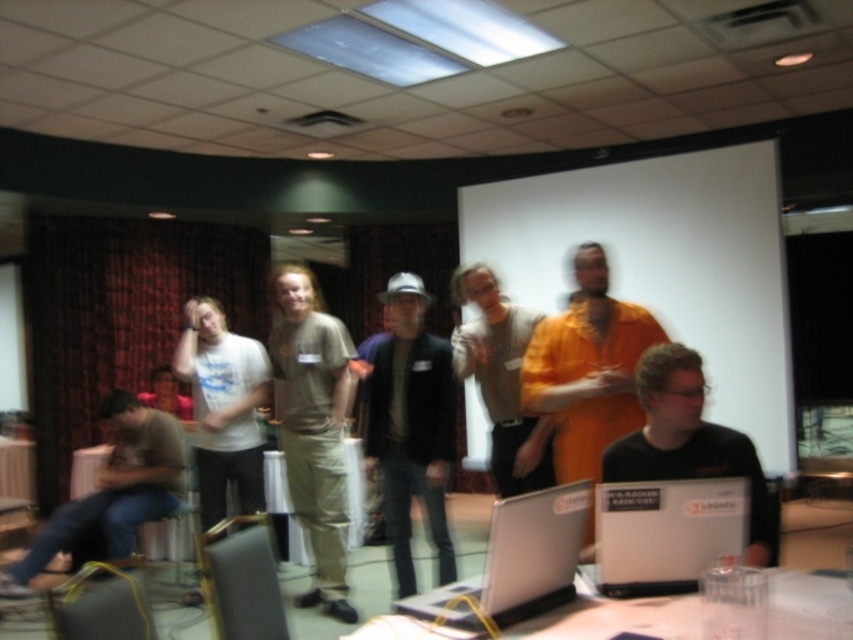
Can you confirm if metallic silver laptop at lower center is positioned above wooden table at lower left?

Yes.

Who is more forward, (x=264, y=611) or (x=71, y=468)?

Positioned in front is point (x=264, y=611).

Between point (242, 538) and point (283, 468), which one is positioned in front?

Point (242, 538)

Where is `metallic silver laptop at lower center`? This screenshot has width=853, height=640. metallic silver laptop at lower center is located at coordinates (241, 580).

Is point (279, 310) behind point (183, 412)?

No, it is not.

Is khaki cotton pants at center positioned in front of matte white shirt at center?

Yes, khaki cotton pants at center is in front of matte white shirt at center.

Which is behind, point (309, 472) or point (154, 406)?

The point (154, 406) is more distant.

Identify the location of khaki cotton pants at center. (312, 426).

Is black matte shirt at center taller than silver metallic laptop at center?

Yes, black matte shirt at center is taller than silver metallic laptop at center.

Does point (648, 412) lie behind point (546, 541)?

Yes.

Locate an element on the screen. This screenshot has width=853, height=640. black matte shirt at center is located at coordinates (688, 440).